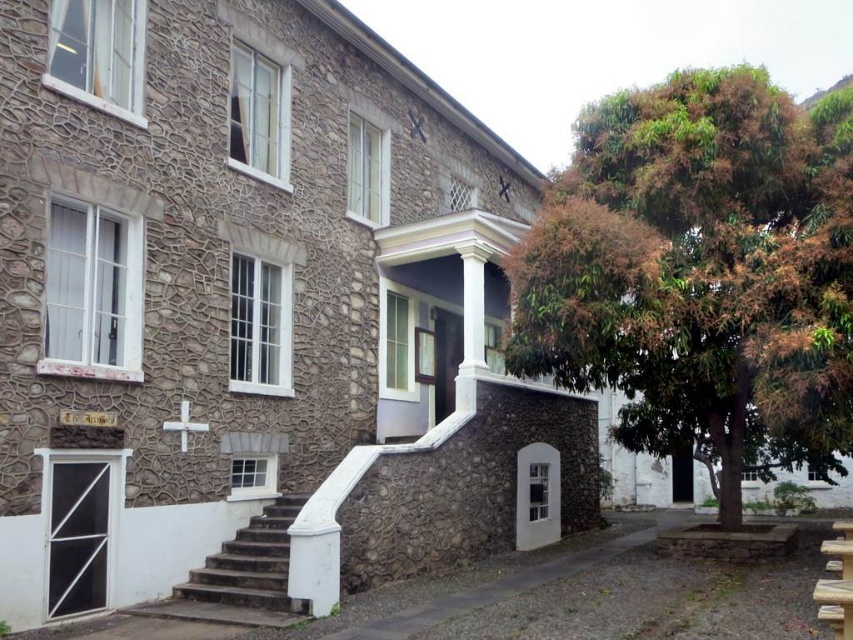
Between point (614, 209) and point (277, 602), which one is positioned in front?

Positioned in front is point (277, 602).

Where is `brown leafy tree at right`? This screenshot has width=853, height=640. brown leafy tree at right is located at coordinates (701, 273).